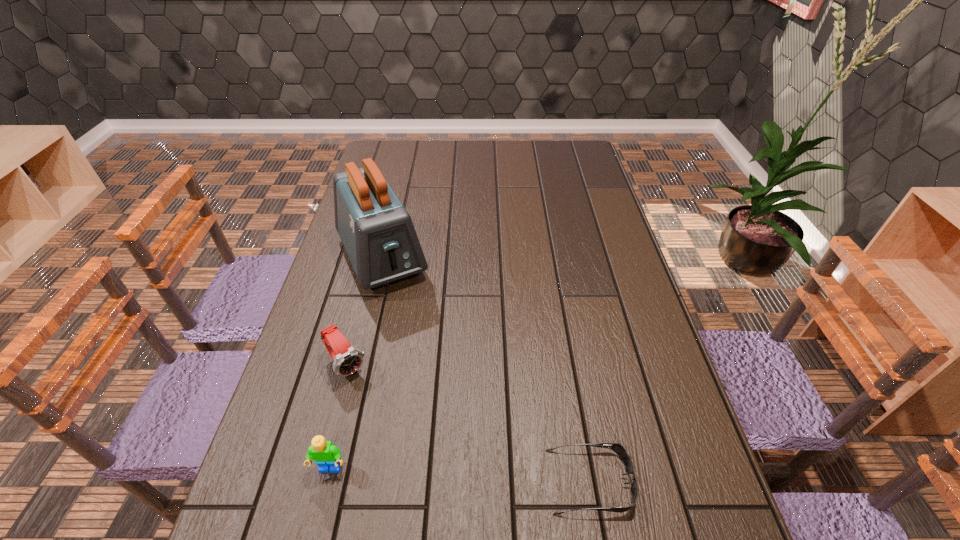
The height and width of the screenshot is (540, 960). Identify the location of vacant region located 0.280m on the face of the watch. (425, 473).

Where is `free space located 0.400m on the front-facing side of the farthest object`? The height and width of the screenshot is (540, 960). free space located 0.400m on the front-facing side of the farthest object is located at coordinates (455, 411).

Where is `vacant space located 0.280m on the front-facing side of the farthest object`? The width and height of the screenshot is (960, 540). vacant space located 0.280m on the front-facing side of the farthest object is located at coordinates (435, 371).

Locate an element on the screen. This screenshot has height=540, width=960. vacant space located on the front-facing side of the farthest object is located at coordinates (448, 397).

Locate an element on the screen. Lego located at the near edge is located at coordinates (327, 456).

Image resolution: width=960 pixels, height=540 pixels. I want to click on sunglasses that is at the near edge, so click(x=616, y=447).

I want to click on Lego that is positioned at the left edge, so click(x=327, y=456).

This screenshot has width=960, height=540. I want to click on watch at the left edge, so click(347, 359).

Image resolution: width=960 pixels, height=540 pixels. I want to click on toaster present at the left edge, so click(x=377, y=232).

The image size is (960, 540). I want to click on object positioned at the right edge, so click(616, 447).